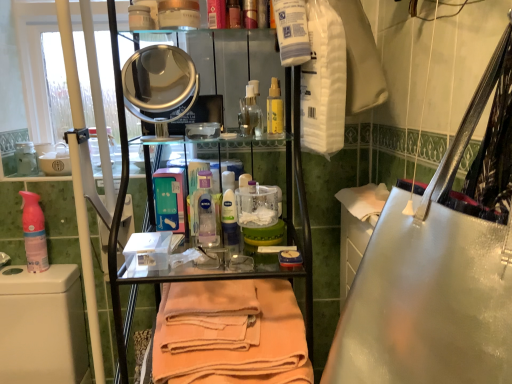
The image size is (512, 384). Identify the location of yellow matte bottle at center. (275, 109).

At what (x,y) coordinates should I click in order to perform the action: click on pink matte spray can at left, which ranks as the first cleaning product in left-to-right order. Please return your answer as a coordinate pair (x, y). The image size is (512, 384). Looking at the image, I should click on (34, 233).

The height and width of the screenshot is (384, 512). In order to click on white plastic toilet at lower left in this screenshot , I will do `click(42, 325)`.

Find the location of a particular element. The height and width of the screenshot is (384, 512). the 2nd cleaning product located beneath the yellow matte bottle at center (from a real-world perspective) is located at coordinates (34, 233).

From a real-world perspective, between yellow matte bottle at center and pink matte spray can at left, which ranks as the first cleaning product in left-to-right order, who is vertically lower?

pink matte spray can at left, which ranks as the first cleaning product in left-to-right order, is physically lower.

Is the surface of yellow matte bottle at center in direct contact with pink matte spray can at left, the 2th cleaning product viewed from the right?

yellow matte bottle at center and pink matte spray can at left, the 2th cleaning product viewed from the right, are not in contact.

Is yellow matte bottle at center further to camera compared to pink matte spray can at left, which ranks as the first cleaning product in left-to-right order?

No, it is in front of pink matte spray can at left, which ranks as the first cleaning product in left-to-right order.

Are orange cotton towel at center and white plastic toilet at lower left beside each other?

orange cotton towel at center is not next to white plastic toilet at lower left, and they're not touching.

What's the angular difference between orange cotton towel at center and white plastic toilet at lower left's facing directions?

The angular difference between orange cotton towel at center and white plastic toilet at lower left is 0.868 degrees.

Who is taller, orange cotton towel at center or white plastic toilet at lower left?

With more height is white plastic toilet at lower left.

Can white plastic toilet at lower left be found inside orange cotton towel at center?

No, orange cotton towel at center does not contain white plastic toilet at lower left.

Considering their positions, is translucent plastic bottle at center, which ranks as the 2th cleaning product in left-to-right order, located in front of or behind orange cotton towel at center?

Answer: Clearly, translucent plastic bottle at center, which ranks as the 2th cleaning product in left-to-right order, is behind orange cotton towel at center.

From a real-world perspective, which object rests below the other?

In real-world perspective, orange cotton towel at center is lower.

Locate an element on the screen. The image size is (512, 384). towel to the right of translucent plastic bottle at center, arranged as the first cleaning product when viewed from the front is located at coordinates (230, 333).

Between point (211, 241) and point (170, 294), which one is positioned behind?

The point (211, 241) is behind.

How different are the orientations of pink matte spray can at left, placed as the first cleaning product when sorted from back to front, and yellow matte bottle at center in degrees?

15.8 degrees.

From a real-world perspective, which object rests below the other?

In real-world perspective, pink matte spray can at left, the 2th cleaning product viewed from the right, is lower.

Visually, is pink matte spray can at left, which ranks as the first cleaning product in left-to-right order, positioned to the left or to the right of yellow matte bottle at center?

Clearly, pink matte spray can at left, which ranks as the first cleaning product in left-to-right order, is on the left of yellow matte bottle at center in the image.

Find the location of a particular element. The width and height of the screenshot is (512, 384). mouthwash on the right of the pink matte spray can at left, placed as the first cleaning product when sorted from back to front is located at coordinates (275, 109).

Does point (212, 246) lie behind point (30, 200)?

No, it is not.

Is translucent plastic bottle at center, the first cleaning product viewed from the right, placed right next to pink matte spray can at left, the 2th cleaning product viewed from the right?

No, translucent plastic bottle at center, the first cleaning product viewed from the right, is not making contact with pink matte spray can at left, the 2th cleaning product viewed from the right.

From a real-world perspective, which object stands above the other?

translucent plastic bottle at center, which ranks as the 2th cleaning product in left-to-right order, is physically above.

Considering the relative sizes of translucent plastic bottle at center, the second cleaning product viewed from the back, and pink matte spray can at left, which is the 2th cleaning product from front to back, in the image provided, is translucent plastic bottle at center, the second cleaning product viewed from the back, wider than pink matte spray can at left, which is the 2th cleaning product from front to back,?

Yes.

Can you confirm if orange cotton towel at center is smaller than yellow matte bottle at center?

No, orange cotton towel at center is not smaller than yellow matte bottle at center.

Consider the image. Is the surface of orange cotton towel at center in direct contact with yellow matte bottle at center?

orange cotton towel at center and yellow matte bottle at center are clearly separated.

From the image's perspective, which is below, orange cotton towel at center or yellow matte bottle at center?

orange cotton towel at center, from the image's perspective.

From a real-world perspective, between orange cotton towel at center and yellow matte bottle at center, who is vertically lower?

From a 3D spatial view, orange cotton towel at center is below.

Is the surface of pink matte spray can at left, the 2th cleaning product viewed from the right, in direct contact with white plastic toilet at lower left?

There is a gap between pink matte spray can at left, the 2th cleaning product viewed from the right, and white plastic toilet at lower left.

Based on their positions, is pink matte spray can at left, the 2th cleaning product viewed from the right, located to the left or right of white plastic toilet at lower left?

In the image, pink matte spray can at left, the 2th cleaning product viewed from the right, appears on the right side of white plastic toilet at lower left.

Which object is wider, pink matte spray can at left, which ranks as the first cleaning product in left-to-right order, or white plastic toilet at lower left?

With larger width is white plastic toilet at lower left.

Between point (30, 237) and point (36, 324), which one is positioned behind?

The point (30, 237) is farther from the camera.

Where is `mouthwash located on the right of pink matte spray can at left, placed as the first cleaning product when sorted from back to front`? The width and height of the screenshot is (512, 384). mouthwash located on the right of pink matte spray can at left, placed as the first cleaning product when sorted from back to front is located at coordinates (275, 109).

Image resolution: width=512 pixels, height=384 pixels. Find the location of `towel that appears in front of the white plastic toilet at lower left`. towel that appears in front of the white plastic toilet at lower left is located at coordinates (230, 333).

Looking at the image, which one is located further to translucent plastic bottle at center, the first cleaning product viewed from the right, yellow matte bottle at center or orange cotton towel at center?

Among the two, yellow matte bottle at center is located further to translucent plastic bottle at center, the first cleaning product viewed from the right.

Based on their spatial positions, is pink matte spray can at left, placed as the first cleaning product when sorted from back to front, or white plastic toilet at lower left further from orange cotton towel at center?

Among the two, pink matte spray can at left, placed as the first cleaning product when sorted from back to front, is located further to orange cotton towel at center.

Estimate the real-world distances between objects in this image. Which object is further from orange cotton towel at center, white plastic toilet at lower left or pink matte spray can at left, which is the 2th cleaning product from front to back?

pink matte spray can at left, which is the 2th cleaning product from front to back, lies further to orange cotton towel at center than the other object.

Based on their spatial positions, is white plastic toilet at lower left or translucent plastic bottle at center, the second cleaning product viewed from the back, closer to orange cotton towel at center?

Among the two, translucent plastic bottle at center, the second cleaning product viewed from the back, is located nearer to orange cotton towel at center.

Which object lies nearer to the anchor point yellow matte bottle at center, pink matte spray can at left, the 2th cleaning product viewed from the right, or white plastic toilet at lower left?

pink matte spray can at left, the 2th cleaning product viewed from the right, is positioned closer to the anchor yellow matte bottle at center.

From the image, which object appears to be nearer to pink matte spray can at left, the 2th cleaning product viewed from the right, white plastic toilet at lower left or translucent plastic bottle at center, which ranks as the 2th cleaning product in left-to-right order?

Among the two, white plastic toilet at lower left is located nearer to pink matte spray can at left, the 2th cleaning product viewed from the right.

Which object lies nearer to the anchor point yellow matte bottle at center, white plastic toilet at lower left or orange cotton towel at center?

orange cotton towel at center is positioned closer to the anchor yellow matte bottle at center.

Looking at the image, which one is located closer to translucent plastic bottle at center, the second cleaning product viewed from the back, yellow matte bottle at center or pink matte spray can at left, placed as the first cleaning product when sorted from back to front?

The object closer to translucent plastic bottle at center, the second cleaning product viewed from the back, is yellow matte bottle at center.

Find the location of a particular element. The width and height of the screenshot is (512, 384). cleaning product situated between pink matte spray can at left, the 2th cleaning product viewed from the right, and orange cotton towel at center from left to right is located at coordinates pos(205,212).

Find the location of a particular element. This screenshot has height=384, width=512. towel situated between pink matte spray can at left, which ranks as the first cleaning product in left-to-right order, and yellow matte bottle at center from left to right is located at coordinates (230, 333).

At what (x,y) coordinates should I click in order to perform the action: click on towel between white plastic toilet at lower left and yellow matte bottle at center from left to right. Please return your answer as a coordinate pair (x, y). The height and width of the screenshot is (384, 512). Looking at the image, I should click on (230, 333).

Locate an element on the screen. cleaning product situated between white plastic toilet at lower left and translucent plastic bottle at center, the second cleaning product viewed from the back, from left to right is located at coordinates (34, 233).